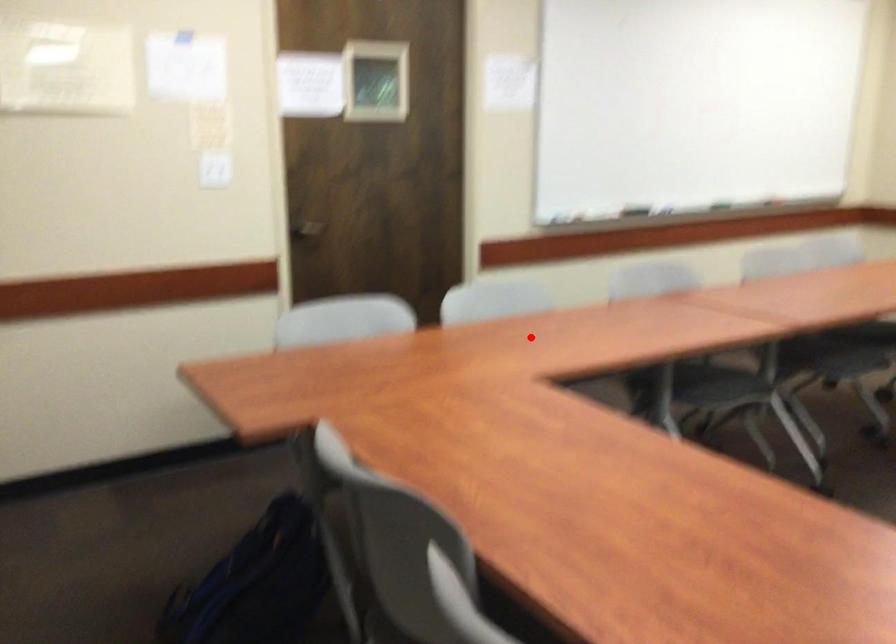
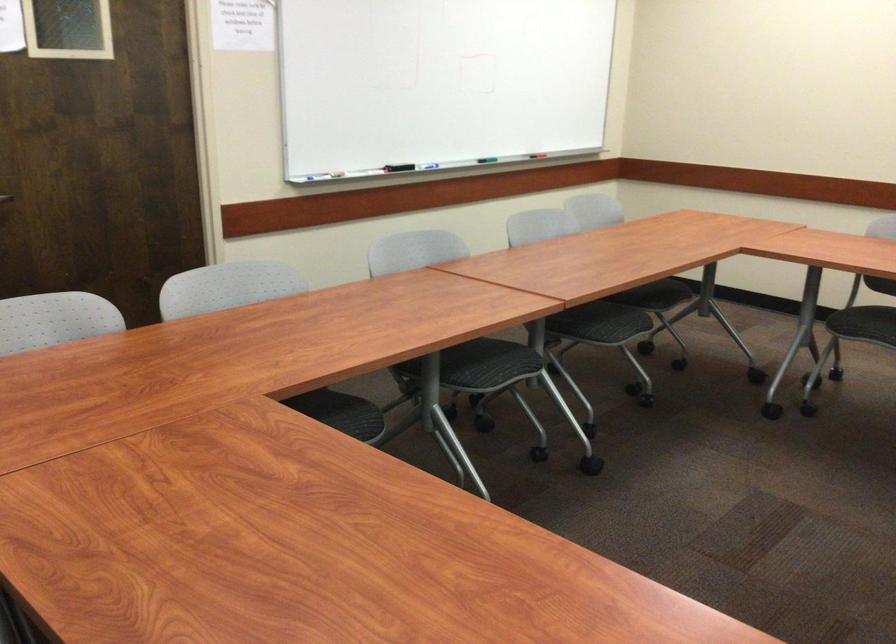
In the second image, find the point that corresponds to the highlighted location in the first image.

(265, 330)